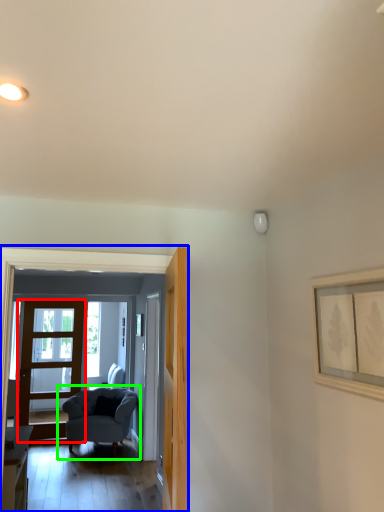
Question: Which object is the farthest from door (highlighted by a red box)? Choose among these: residence (highlighted by a blue box) or chair (highlighted by a green box).

Choices:
 (A) residence
 (B) chair

Answer: (A)